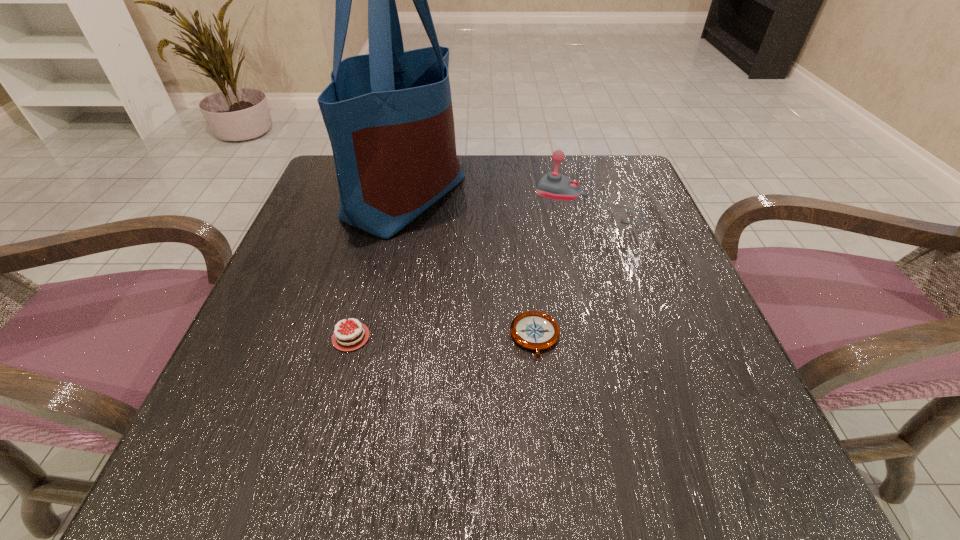
Find the location of a particular element. vacant area at the far right corner is located at coordinates (623, 183).

At what (x,y) coordinates should I click in order to perform the action: click on vacant region between the handbag and the chocolate cake. Please return your answer as a coordinate pair (x, y). This screenshot has height=540, width=960. Looking at the image, I should click on (378, 267).

At what (x,y) coordinates should I click in order to perform the action: click on vacant area between the third shortest object and the tallest object. Please return your answer as a coordinate pair (x, y). Looking at the image, I should click on (497, 200).

Identify the location of free space between the tallest object and the joystick. (497, 200).

The width and height of the screenshot is (960, 540). In order to click on vacant space that's between the joystick and the handbag in this screenshot , I will do `click(497, 200)`.

Locate an element on the screen. unoccupied area between the shortest object and the chocolate cake is located at coordinates (443, 337).

Identify the location of free space between the compass and the tallest object. (470, 267).

The width and height of the screenshot is (960, 540). I want to click on vacant area between the tallest object and the joystick, so click(497, 200).

Identify the location of free space that is in between the shortest object and the tallest object. Image resolution: width=960 pixels, height=540 pixels. (470, 267).

At what (x,y) coordinates should I click in order to perform the action: click on free spot between the second shortest object and the third shortest object. Please return your answer as a coordinate pair (x, y). This screenshot has height=540, width=960. Looking at the image, I should click on coord(470,271).